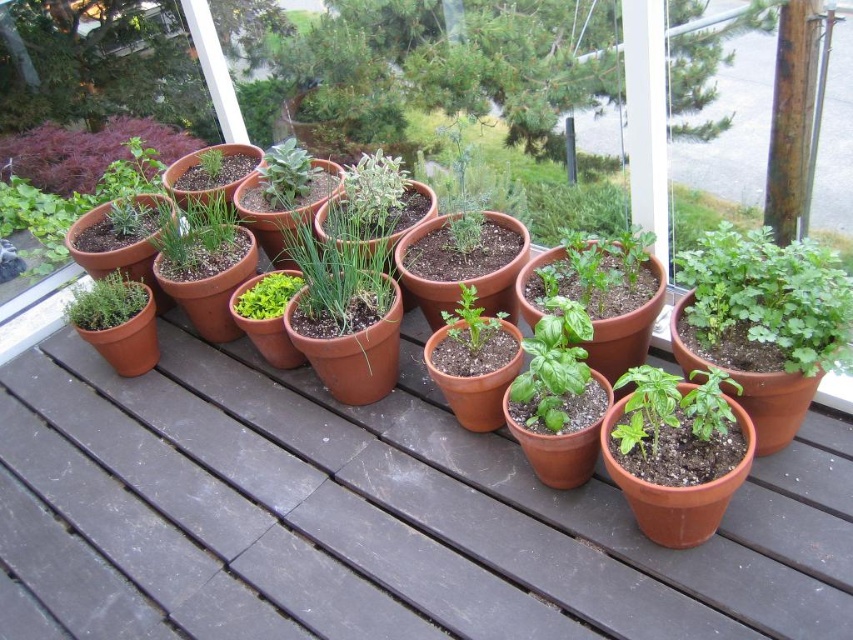
Is green matte herb at center-right further to camera compared to green matte herb at upper center?

No.

Who is shorter, green matte herb at center-right or green matte herb at upper center?

Standing shorter between the two is green matte herb at upper center.

Does point (844, 336) come in front of point (292, 179)?

Yes, point (844, 336) is in front of point (292, 179).

Find the location of a particular element. green matte herb at center-right is located at coordinates (766, 301).

Based on the photo, who is more distant from viewer, (703, 326) or (76, 323)?

Point (76, 323)

Which of these two, green matte herb at center-right or green matte herb at left, stands taller?

With more height is green matte herb at center-right.

This screenshot has height=640, width=853. Describe the element at coordinates (766, 301) in the screenshot. I see `green matte herb at center-right` at that location.

Find the location of a particular element. green matte herb at center-right is located at coordinates (766, 301).

Does green matte herb at left have a greater height compared to green matte leafy plant at center?

Yes, green matte herb at left is taller than green matte leafy plant at center.

Is point (102, 289) less distant than point (279, 314)?

No, it is behind (279, 314).

Find the location of a particular element. This screenshot has height=640, width=853. green matte herb at left is located at coordinates (105, 301).